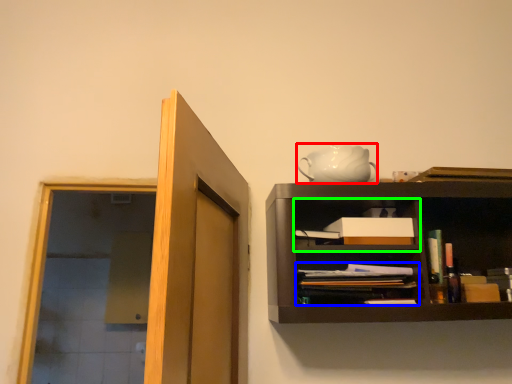
Question: Based on their relative distances, which object is nearer to tea pot (highlighted by a red box)? Choose from book (highlighted by a blue box) and cabinet (highlighted by a green box).

Choices:
 (A) book
 (B) cabinet

Answer: (B)